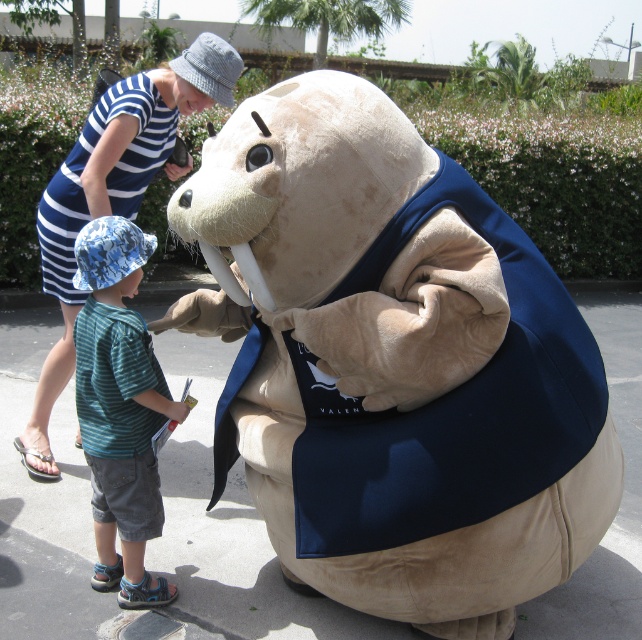
Question: Which point is farther to the camera?

Choices:
 (A) fuzzy beige plush at center
 (B) striped cotton dress at upper left
 (C) blue striped dress at upper left

Answer: (C)

Question: Estimate the real-world distances between objects in this image. Which object is farther from the striped cotton shirt at center?

Choices:
 (A) blue striped dress at upper left
 (B) striped cotton dress at upper left

Answer: (A)

Question: Can you confirm if fuzzy beige plush at center is positioned above striped cotton dress at upper left?

Choices:
 (A) yes
 (B) no

Answer: (B)

Question: Is fuzzy beige plush at center in front of blue striped dress at upper left?

Choices:
 (A) yes
 (B) no

Answer: (A)

Question: Estimate the real-world distances between objects in this image. Which object is closer to the blue striped dress at upper left?

Choices:
 (A) fuzzy beige plush at center
 (B) striped cotton shirt at center

Answer: (B)

Question: Observing the image, what is the correct spatial positioning of fuzzy beige plush at center in reference to striped cotton dress at upper left?

Choices:
 (A) left
 (B) right

Answer: (B)